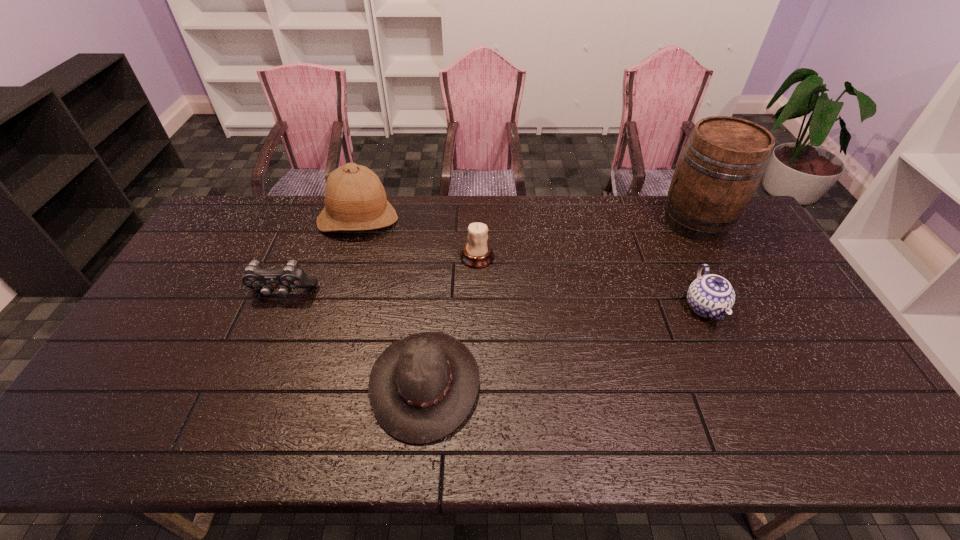
Where is `free spot between the right hat and the tallest object`? free spot between the right hat and the tallest object is located at coordinates (561, 302).

Find the location of `free point between the control and the chinaware`. free point between the control and the chinaware is located at coordinates (494, 301).

I want to click on free space between the control and the candle holder, so tap(380, 275).

Find the location of a particular element. vacant area that lies between the taller hat and the candle holder is located at coordinates (418, 239).

Where is `blank region between the right hat and the left hat`? This screenshot has height=540, width=960. blank region between the right hat and the left hat is located at coordinates (392, 302).

Point out which object is positioned as the nearest to the cider. Please provide its 2D coordinates. Your answer should be formatted as a tuple, i.e. [(x, y)], where the tuple contains the x and y coordinates of a point satisfying the conditions above.

[(710, 295)]

The image size is (960, 540). I want to click on the fifth closest object to the tallest object, so click(x=255, y=277).

Where is `free space that satisfies the following two spatial constraints: 1. on the side of the tallest object near the bung hole; 2. on the front side of the candle holder`? This screenshot has width=960, height=540. free space that satisfies the following two spatial constraints: 1. on the side of the tallest object near the bung hole; 2. on the front side of the candle holder is located at coordinates (714, 257).

At what (x,y) coordinates should I click in order to perform the action: click on free location that satisfies the following two spatial constraints: 1. on the side of the tallest object near the bung hole; 2. at the spout of the chinaware. Please return your answer as a coordinate pair (x, y). Image resolution: width=960 pixels, height=540 pixels. Looking at the image, I should click on click(x=741, y=307).

Where is `vacant region that satisfies the following two spatial constraints: 1. on the side of the tallest object near the bung hole; 2. at the spout of the chinaware`? The width and height of the screenshot is (960, 540). vacant region that satisfies the following two spatial constraints: 1. on the side of the tallest object near the bung hole; 2. at the spout of the chinaware is located at coordinates (741, 307).